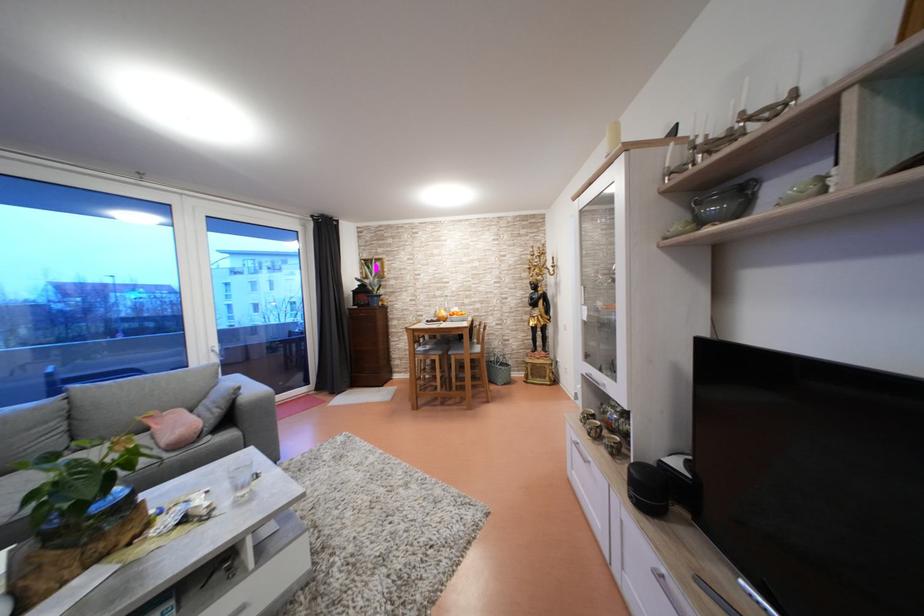
Find the location of a particular element. small ceramic cup is located at coordinates (599, 430).